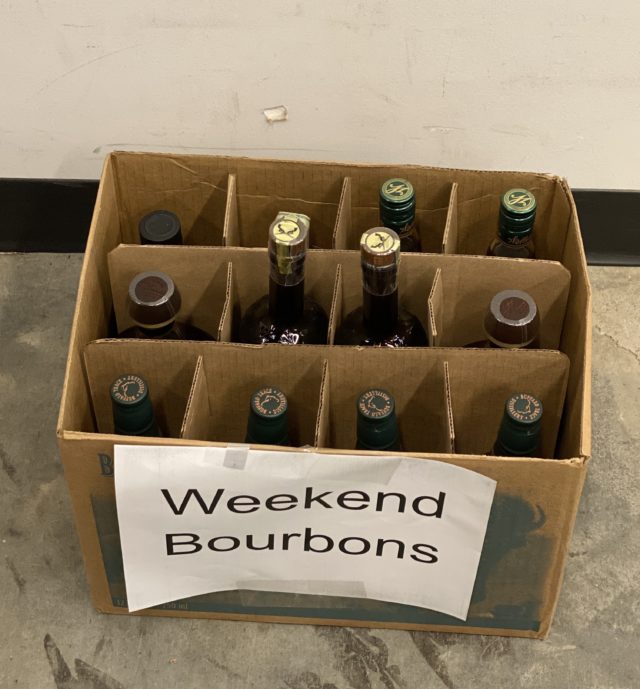
This screenshot has height=689, width=640. Find the location of `brown cardboard box`. brown cardboard box is located at coordinates (557, 481).